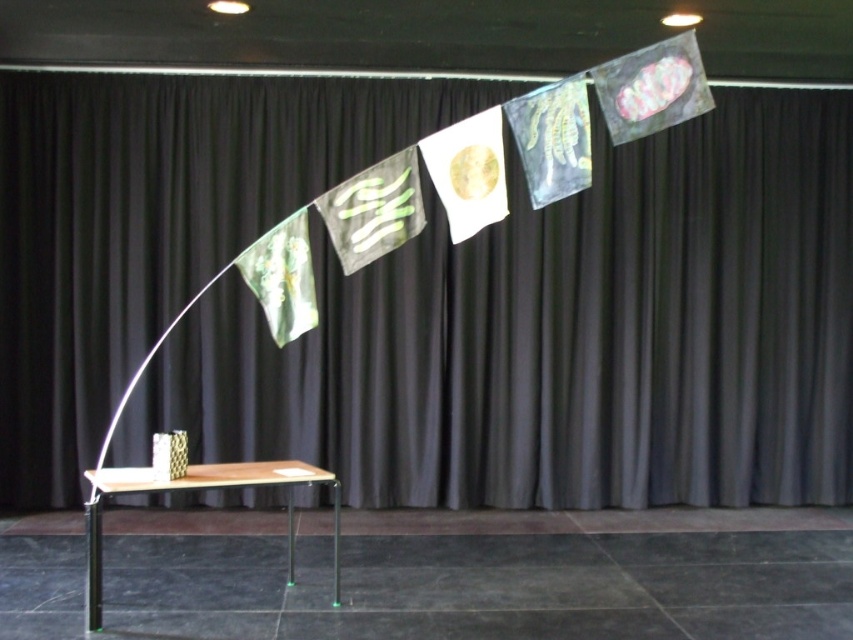
Question: Is black fabric curtain at upper center closer to camera compared to wooden table at center?

Choices:
 (A) yes
 (B) no

Answer: (B)

Question: Can you confirm if black fabric curtain at upper center is thinner than wooden table at center?

Choices:
 (A) yes
 (B) no

Answer: (B)

Question: Which object is farther from the camera taking this photo?

Choices:
 (A) wooden table at center
 (B) black fabric curtain at upper center

Answer: (B)

Question: Is black fabric curtain at upper center thinner than wooden table at center?

Choices:
 (A) no
 (B) yes

Answer: (A)